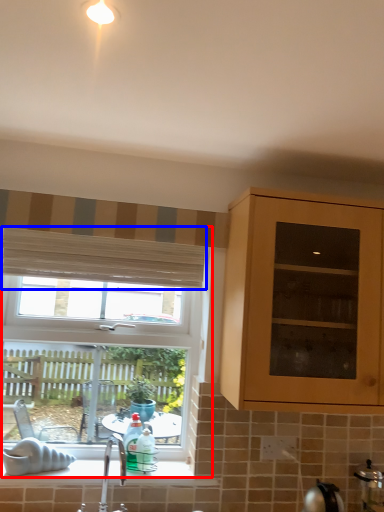
Question: Which object is closer to the camera taking this photo, window (highlighted by a red box) or curtain (highlighted by a blue box)?

Choices:
 (A) window
 (B) curtain

Answer: (A)